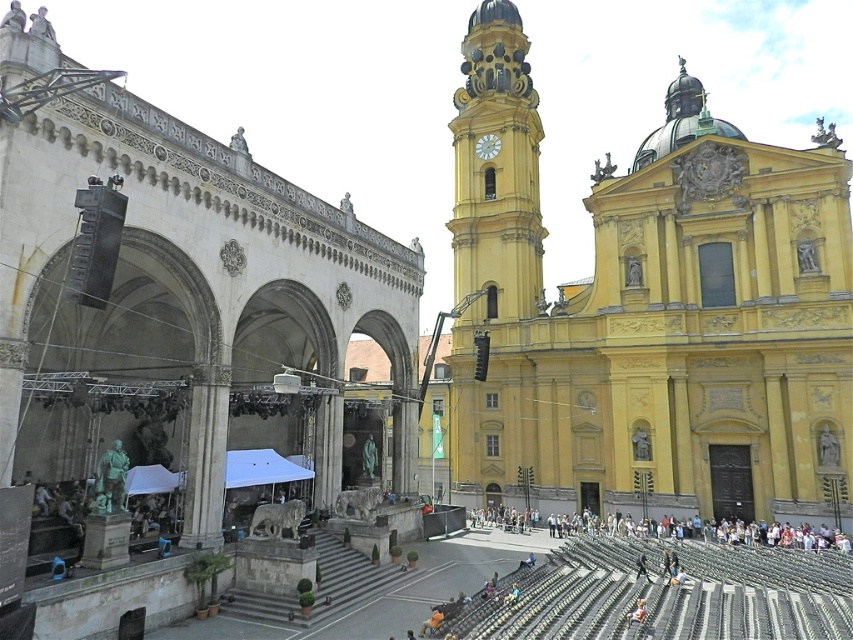
You are an event planner looking to set up a photo backdrop for a wedding. The backdrop needs to be placed in front of the yellow stone church at center so that the yellow matte clock tower at upper center is visible in the background. Is this possible given their positions?

The yellow stone church at center is located below the yellow matte clock tower at upper center, so placing the backdrop in front of the yellow stone church at center will allow the yellow matte clock tower at upper center to be visible in the background.

You are standing at the center of the stage under the white canopy tent in front of the grand stone structure. You want to walk directly to the yellow building with the clock tower. Which direction should you move relative to the two points labeled as point (500, 273) and point (529, 531)?

Since point (500, 273) is behind point (529, 531), you should move towards the direction of point (529, 531) to reach the yellow building with the clock tower as it is closer to your path.

You are standing at the center of the image and want to locate the yellow stone church at center. According to the coordinates provided, in which direction should you look to find it?

The yellow stone church at center is located at coordinates point [650,314]. Since you are at the center, you should look directly ahead as the coordinates are nearly the center point of the image.